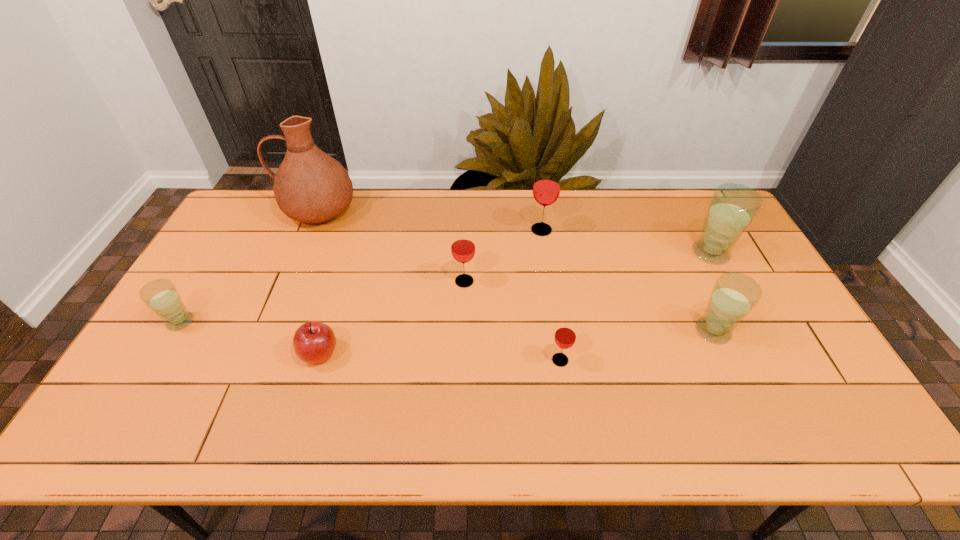
Where is `the tallest object`? The height and width of the screenshot is (540, 960). the tallest object is located at coordinates (310, 186).

Where is `the farthest glass`? the farthest glass is located at coordinates (546, 189).

This screenshot has height=540, width=960. Identify the location of the farthest red glass. (546, 189).

Where is `the fifth nearest glass`? This screenshot has height=540, width=960. the fifth nearest glass is located at coordinates (732, 208).

Locate an element on the screen. the sixth nearest object is located at coordinates (732, 208).

This screenshot has width=960, height=540. Find the location of `the leftmost red glass`. the leftmost red glass is located at coordinates (463, 249).

At what (x,y) coordinates should I click in order to perform the action: click on the fourth nearest glass. Please return your answer as a coordinate pair (x, y). This screenshot has height=540, width=960. Looking at the image, I should click on (463, 249).

Where is `the second smallest blue glass`? Image resolution: width=960 pixels, height=540 pixels. the second smallest blue glass is located at coordinates (733, 296).

I want to click on the smallest red glass, so click(565, 335).

Where is `the nearest red glass`? the nearest red glass is located at coordinates (565, 335).